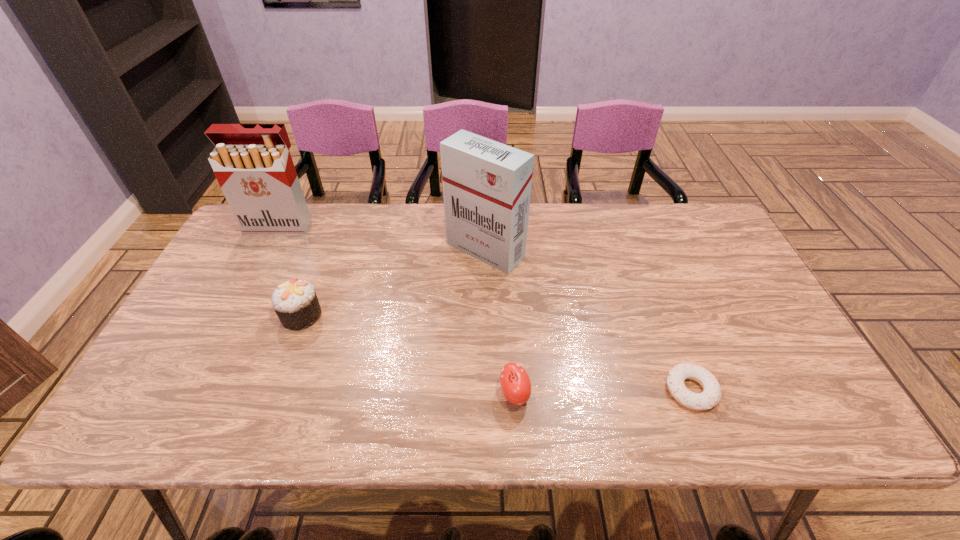
The width and height of the screenshot is (960, 540). Identify the location of the right cigarette case. (487, 185).

Identify the location of the leftmost object. coord(252,163).

Image resolution: width=960 pixels, height=540 pixels. What are the coordinates of `the third farthest object` in the screenshot? It's located at (295, 302).

The image size is (960, 540). I want to click on the third tallest object, so click(x=295, y=302).

Locate an element on the screen. apple is located at coordinates (515, 383).

Where is `the rightmost object`? This screenshot has height=540, width=960. the rightmost object is located at coordinates (711, 395).

At what (x,y) coordinates should I click in order to perform the action: click on doughnut. Please return your answer as a coordinate pair (x, y). Looking at the image, I should click on (711, 395).

Identify the location of vacant space situated 0.100m on the left of the right cigarette case. (414, 251).

The width and height of the screenshot is (960, 540). Find the location of `vacant space located with the lid open on the leftmost object`. vacant space located with the lid open on the leftmost object is located at coordinates (231, 319).

You are a GUI agent. You are given a task and a screenshot of the screen. Output one action in this format:
    pyautogui.click(x=<x>, y=<y>)
    Task: Click on the vacant space situated on the right of the second object from left to right
    
    Given the screenshot: What is the action you would take?
    pyautogui.click(x=454, y=315)